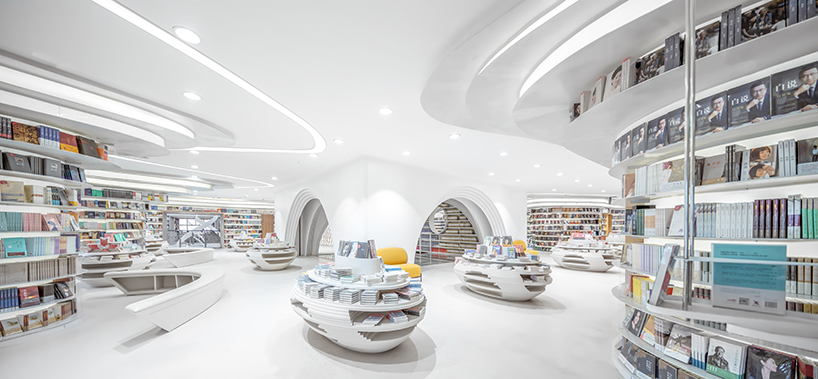
The height and width of the screenshot is (379, 818). What are the coordinates of `ceiling` in the screenshot? It's located at (354, 42).